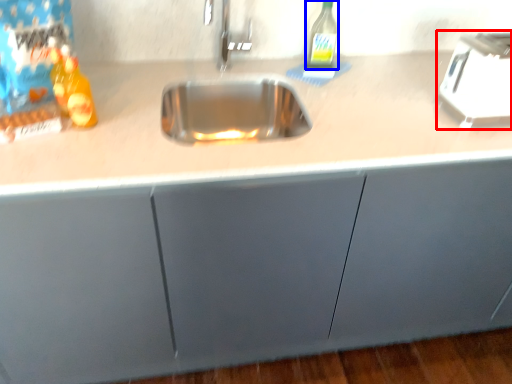
Question: Which object is closer to the camera taking this photo, appliance (highlighted by a red box) or bottle (highlighted by a blue box)?

Choices:
 (A) appliance
 (B) bottle

Answer: (A)